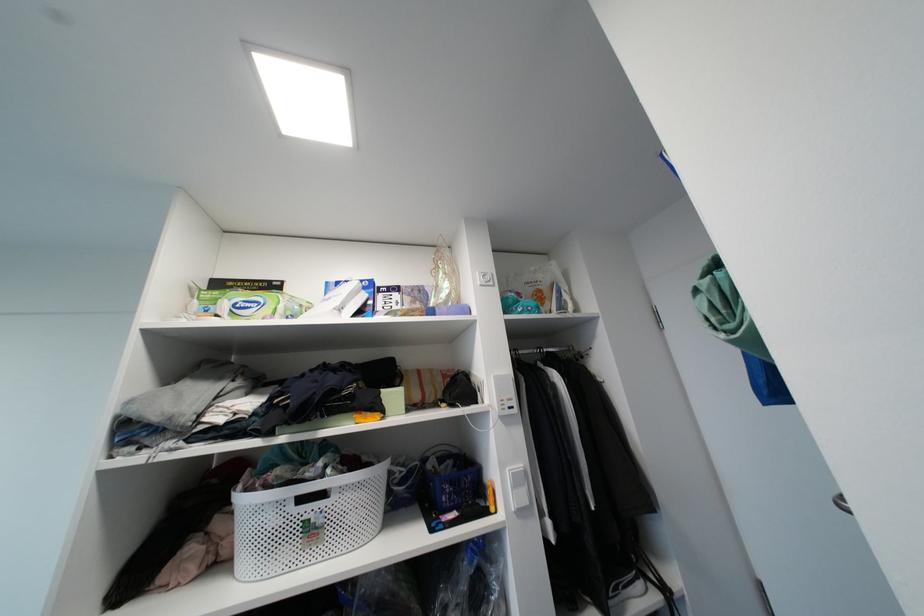
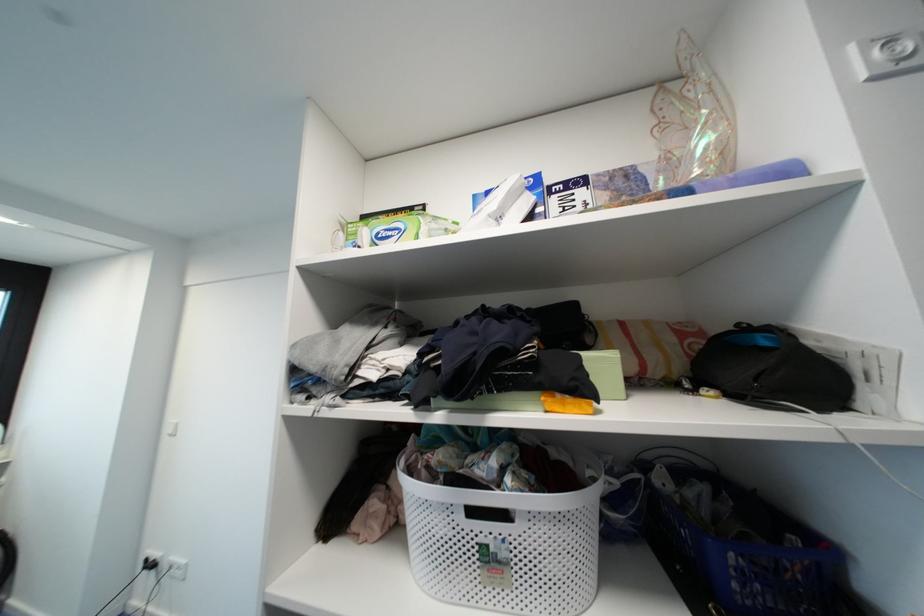
Question: The images are taken continuously from a first-person perspective. In which direction is your viewpoint rotating?

Choices:
 (A) Left
 (B) Right
 (C) Up
 (D) Down

Answer: (A)